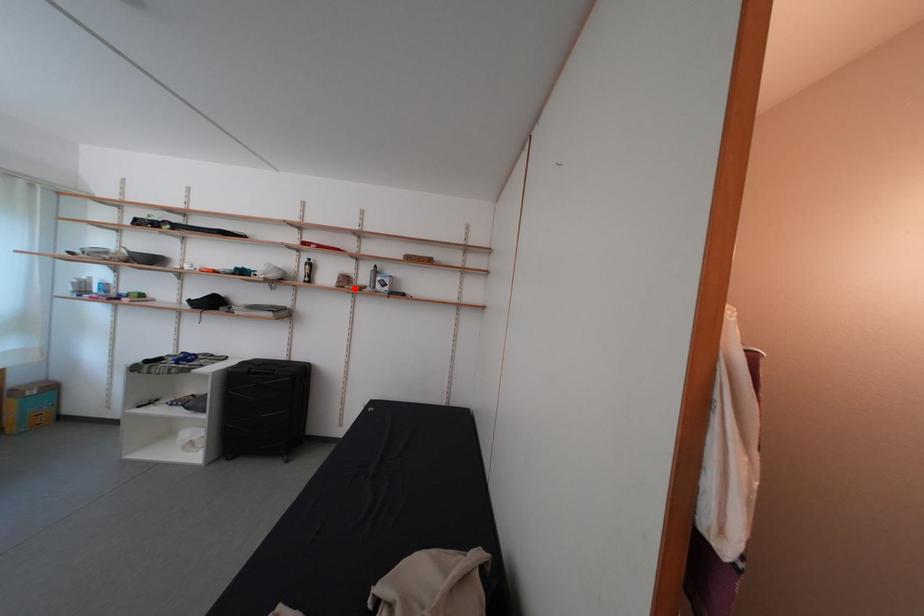
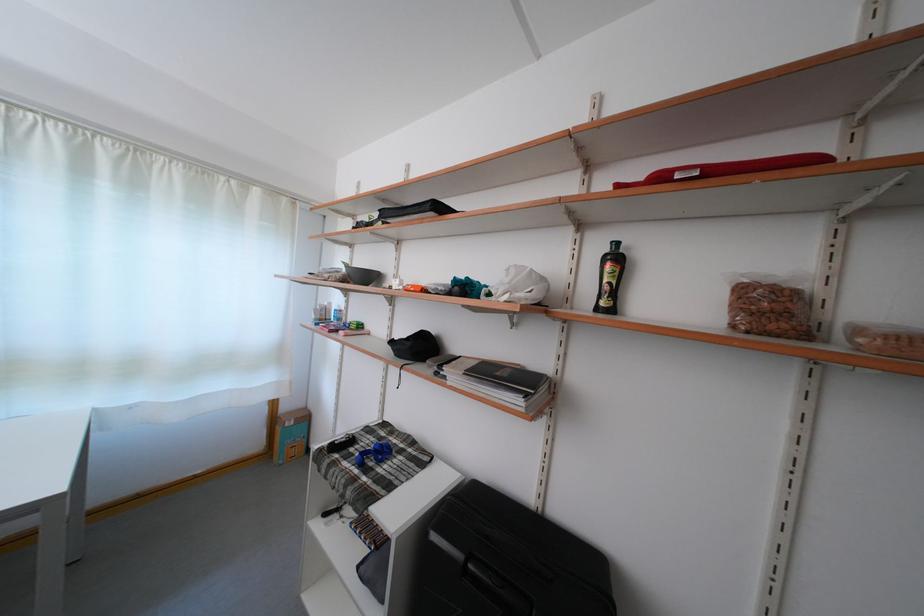
Find the pixel in the second image that matches the highlighted location in the first image.

(782, 321)